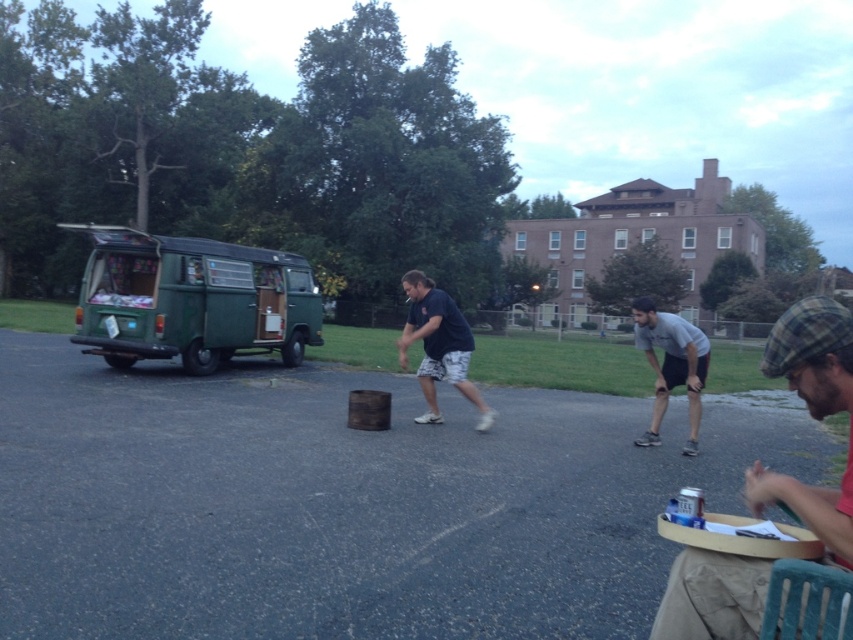
Question: Can you confirm if green matte van at left is positioned to the right of gray matte shirt at center?

Choices:
 (A) no
 (B) yes

Answer: (A)

Question: Is flannel hat at right above dark blue t-shirt at center?

Choices:
 (A) yes
 (B) no

Answer: (B)

Question: Which object appears farthest from the camera in this image?

Choices:
 (A) flannel hat at right
 (B) green matte van at left
 (C) dark blue t-shirt at center
 (D) gray matte shirt at center

Answer: (B)

Question: Considering the real-world distances, which object is farthest from the green matte van at left?

Choices:
 (A) gray matte shirt at center
 (B) dark blue t-shirt at center

Answer: (A)

Question: Where is green matte van at left located in relation to dark blue t-shirt at center in the image?

Choices:
 (A) above
 (B) below

Answer: (A)

Question: Which is nearer to the flannel hat at right?

Choices:
 (A) green matte van at left
 (B) dark blue t-shirt at center
 (C) gray matte shirt at center

Answer: (C)